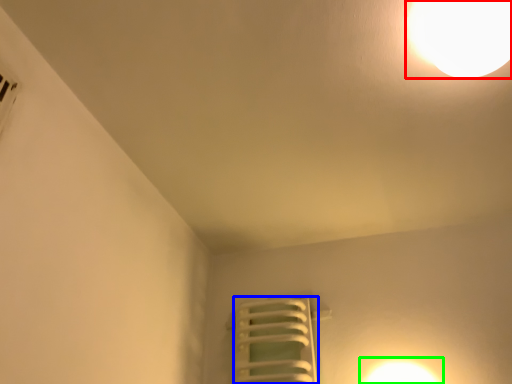
Question: Which object is positioned farthest from lamp (highlighted by a red box)? Select from radiator (highlighted by a blue box) and light (highlighted by a green box).

Choices:
 (A) radiator
 (B) light

Answer: (A)